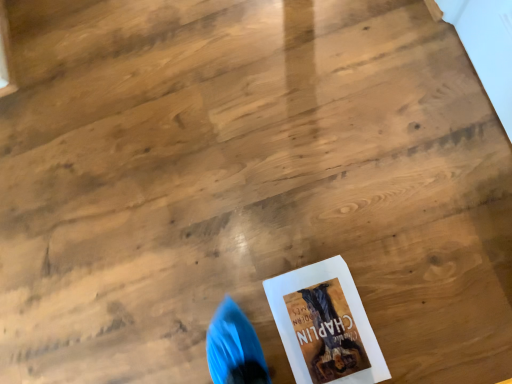
This screenshot has height=384, width=512. What are the coordinates of `blank space situated above white paper book at lower right (from a real-world perspective)` in the screenshot? It's located at (328, 326).